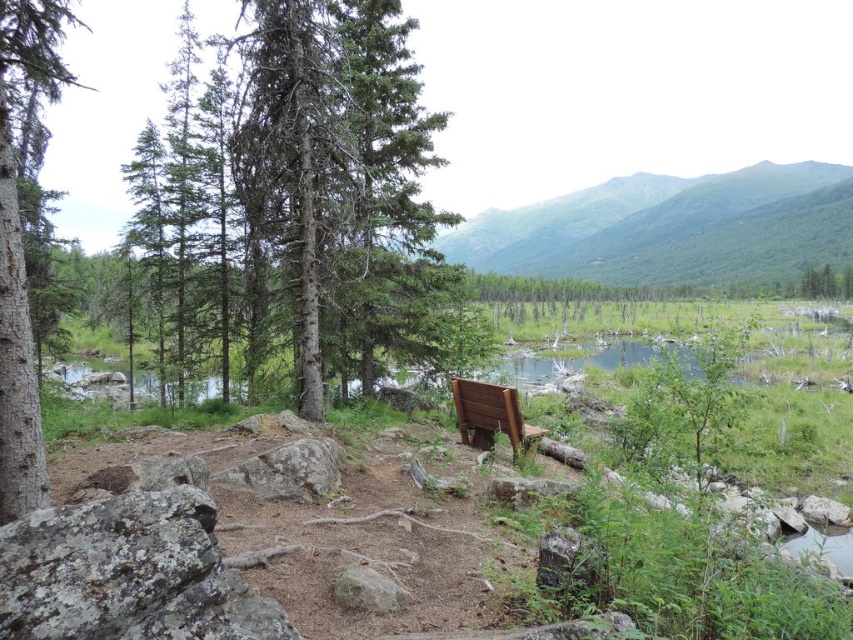
Which is in front, point (405, 257) or point (511, 387)?

Point (511, 387) is more forward.

Who is taller, green textured tree at center or wooden bench at center?

green textured tree at center is taller.

Who is more distant from viewer, (x=178, y=214) or (x=485, y=449)?

Positioned behind is point (x=178, y=214).

Where is `green textured tree at center`? The width and height of the screenshot is (853, 640). green textured tree at center is located at coordinates (344, 193).

At what (x,y) coordinates should I click in order to perform the action: click on green forested mountain at upper center. Please return your answer as a coordinate pair (x, y). This screenshot has height=640, width=853. Looking at the image, I should click on (670, 227).

Does green forested mountain at upper center appear on the left side of wooden bench at center?

Incorrect, green forested mountain at upper center is not on the left side of wooden bench at center.

This screenshot has width=853, height=640. Find the location of `green forested mountain at upper center`. green forested mountain at upper center is located at coordinates (x=670, y=227).

Identify the location of green forested mountain at upper center. The image size is (853, 640). (670, 227).

Is point (412, 122) in front of point (28, 388)?

No, (412, 122) is further to viewer.

From the picture: Is green textured tree at center to the left of green matte tree at left from the viewer's perspective?

No, green textured tree at center is not to the left of green matte tree at left.

Image resolution: width=853 pixels, height=640 pixels. Describe the element at coordinates (344, 193) in the screenshot. I see `green textured tree at center` at that location.

Locate an element on the screen. Image resolution: width=853 pixels, height=640 pixels. green textured tree at center is located at coordinates (344, 193).